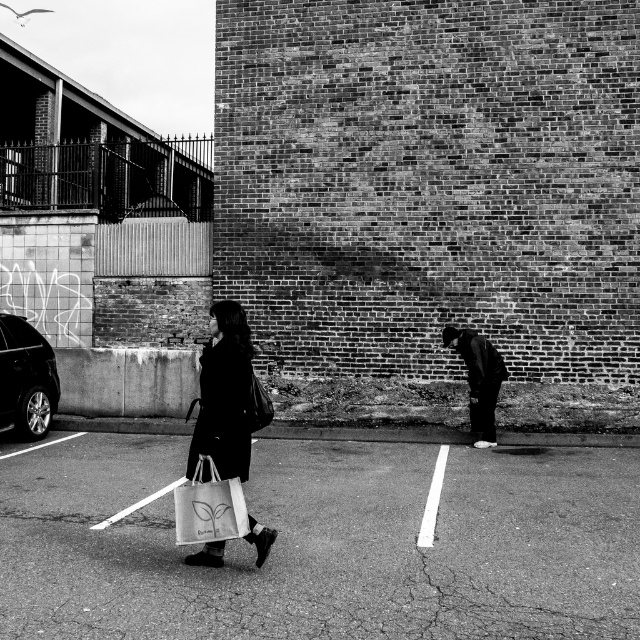
Where is `smooth asphalt parking lot at center`? This screenshot has width=640, height=640. smooth asphalt parking lot at center is located at coordinates (324, 544).

In the scene shown: Who is shorter, smooth asphalt parking lot at center or shiny metallic car at left?

smooth asphalt parking lot at center is shorter.

At what (x,y) coordinates should I click in order to perform the action: click on smooth asphalt parking lot at center. Please return your answer as a coordinate pair (x, y). The width and height of the screenshot is (640, 640). Looking at the image, I should click on (324, 544).

Between shiny metallic car at left and white canvas bag at center, which one has less height?

With less height is white canvas bag at center.

Does shiny metallic car at left have a greater width compared to white canvas bag at center?

No.

The height and width of the screenshot is (640, 640). I want to click on shiny metallic car at left, so click(26, 378).

Is matte black coat at center above white canvas bag at center?

Yes.

Is matte black coat at center smaller than white canvas bag at center?

Actually, matte black coat at center might be larger than white canvas bag at center.

Between point (220, 353) and point (188, 486), which one is positioned behind?

The point (220, 353) is behind.

Where is `matte black coat at center`? Image resolution: width=640 pixels, height=640 pixels. matte black coat at center is located at coordinates (227, 397).